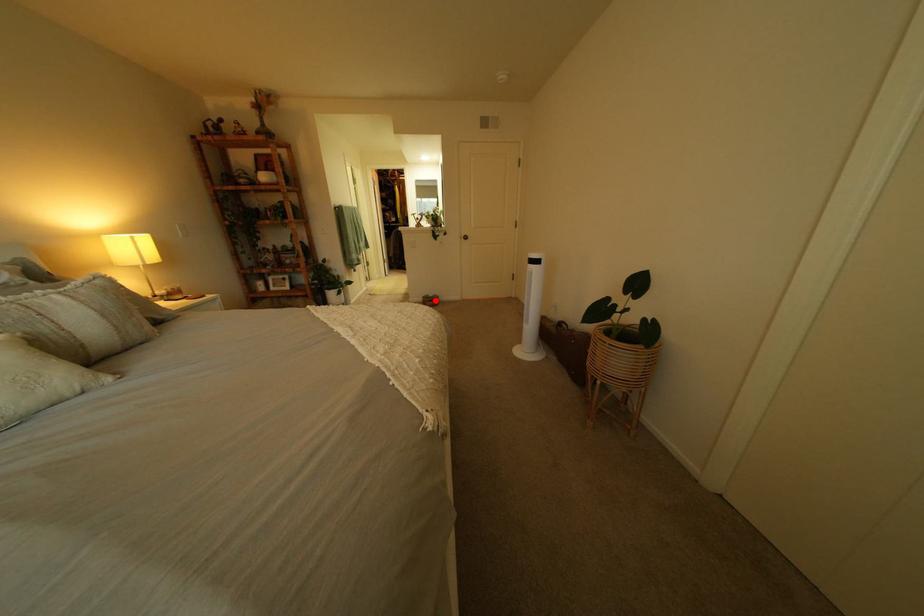
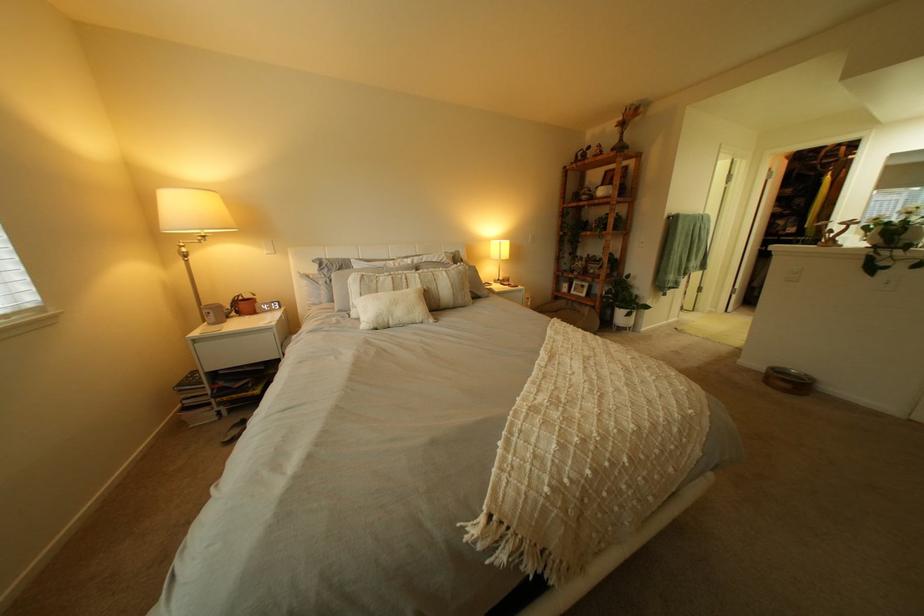
Locate, in the second image, the point that corresponds to the highlighted location in the first image.

(779, 369)